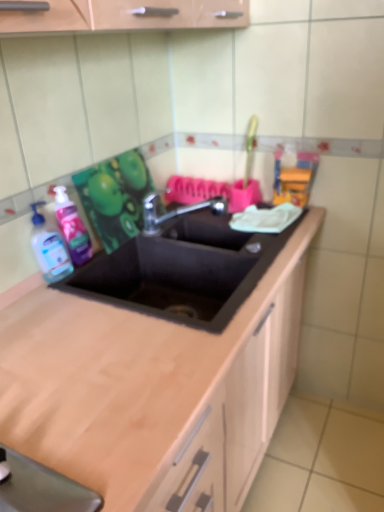
At what (x,y) coordinates should I click in order to perform the action: click on translucent plastic soap dispenser at left. Please return your answer as a coordinate pair (x, y). Image resolution: width=384 pixels, height=512 pixels. Looking at the image, I should click on (72, 228).

The width and height of the screenshot is (384, 512). What do you see at coordinates (182, 270) in the screenshot?
I see `black matte sink at center` at bounding box center [182, 270].

In order to click on transparent plastic bottle at left in this screenshot , I will do `click(49, 249)`.

The height and width of the screenshot is (512, 384). What are the coordinates of `translucent plastic soap dispenser at left` in the screenshot? It's located at (72, 228).

Who is smaller, metallic faucet at center or translucent plastic soap dispenser at left?

Smaller between the two is translucent plastic soap dispenser at left.

Which is more to the right, metallic faucet at center or translucent plastic soap dispenser at left?

metallic faucet at center.

From the image's perspective, relative to translucent plastic soap dispenser at left, is metallic faucet at center above or below?

Clearly, from the image's perspective, metallic faucet at center is above translucent plastic soap dispenser at left.

Which is closer to the camera, (x=61, y=186) or (x=68, y=269)?

Point (x=61, y=186).

Considering the relative sizes of translucent plastic soap dispenser at left and transparent plastic bottle at left in the image provided, is translucent plastic soap dispenser at left bigger than transparent plastic bottle at left?

Actually, translucent plastic soap dispenser at left might be smaller than transparent plastic bottle at left.

Is translucent plastic soap dispenser at left taller or shorter than transparent plastic bottle at left?

Considering their sizes, translucent plastic soap dispenser at left has more height than transparent plastic bottle at left.

Between translucent plastic soap dispenser at left and transparent plastic bottle at left, which one has smaller width?

Thinner between the two is translucent plastic soap dispenser at left.

In the scene shown: Considering their positions, is translucent plastic soap dispenser at left located in front of or behind metallic faucet at center?

translucent plastic soap dispenser at left is positioned closer to the viewer than metallic faucet at center.

Are translucent plastic soap dispenser at left and metallic faucet at center beside each other?

No, translucent plastic soap dispenser at left is not with metallic faucet at center.

Does translucent plastic soap dispenser at left have a greater width compared to metallic faucet at center?

Incorrect, the width of translucent plastic soap dispenser at left does not surpass that of metallic faucet at center.

From the image's perspective, is translucent plastic soap dispenser at left above metallic faucet at center?

No, from the image's perspective, translucent plastic soap dispenser at left is not on top of metallic faucet at center.

From the image's perspective, is metallic faucet at center above or below black matte sink at center?

From the image's perspective, metallic faucet at center appears above black matte sink at center.

Is metallic faucet at center looking in the opposite direction of black matte sink at center?

No, metallic faucet at center is not facing away from black matte sink at center.

Who is more distant, metallic faucet at center or black matte sink at center?

Positioned behind is metallic faucet at center.

Between metallic faucet at center and black matte sink at center, which one appears on the left side from the viewer's perspective?

metallic faucet at center is more to the left.

Is transparent plastic bottle at left to the left of black matte sink at center from the viewer's perspective?

Yes.

In the scene shown: Which of these two, transparent plastic bottle at left or black matte sink at center, stands shorter?

Standing shorter between the two is transparent plastic bottle at left.

Consider the image. From a real-world perspective, is transparent plastic bottle at left positioned under black matte sink at center based on gravity?

No, from a real-world perspective, transparent plastic bottle at left is not beneath black matte sink at center.

From a real-world perspective, between black matte sink at center and metallic faucet at center, who is vertically higher?

metallic faucet at center, from a real-world perspective.

Does point (126, 252) lie in front of point (144, 233)?

Yes, it is.

Could you tell me if black matte sink at center is turned towards metallic faucet at center?

No, black matte sink at center is not turned towards metallic faucet at center.

Is black matte sink at center to the left of transparent plastic bottle at left from the viewer's perspective?

Incorrect, black matte sink at center is not on the left side of transparent plastic bottle at left.

Based on the photo, from the image's perspective, between black matte sink at center and transparent plastic bottle at left, who is located below?

black matte sink at center appears lower in the image.

How many degrees apart are the facing directions of black matte sink at center and transparent plastic bottle at left?

The angle between the facing direction of black matte sink at center and the facing direction of transparent plastic bottle at left is 7.4 degrees.

Locate an element on the screen. tap located above the translucent plastic soap dispenser at left (from the image's perspective) is located at coordinates [x=175, y=210].

You are a GUI agent. You are given a task and a screenshot of the screen. Output one action in this format:
    pyautogui.click(x=<x>, y=<y>)
    Task: Click on the bottle that appears below the translucent plastic soap dispenser at left (from a real-world perspective)
    This screenshot has width=384, height=512.
    Given the screenshot: What is the action you would take?
    pyautogui.click(x=49, y=249)

Based on their spatial positions, is translucent plastic soap dispenser at left or black matte sink at center further from metallic faucet at center?

The object further to metallic faucet at center is translucent plastic soap dispenser at left.

When comparing their distances from transparent plastic bottle at left, does translucent plastic soap dispenser at left or metallic faucet at center seem closer?

translucent plastic soap dispenser at left is positioned closer to the anchor transparent plastic bottle at left.

From the image, which object appears to be farther from black matte sink at center, metallic faucet at center or translucent plastic soap dispenser at left?

Based on the image, translucent plastic soap dispenser at left appears to be further to black matte sink at center.

Estimate the real-world distances between objects in this image. Which object is further from black matte sink at center, translucent plastic soap dispenser at left or transparent plastic bottle at left?

transparent plastic bottle at left is further to black matte sink at center.

Which object lies further to the anchor point black matte sink at center, transparent plastic bottle at left or metallic faucet at center?

transparent plastic bottle at left lies further to black matte sink at center than the other object.

From the image, which object appears to be farther from transparent plastic bottle at left, metallic faucet at center or black matte sink at center?

metallic faucet at center.

From the image, which object appears to be farther from translucent plastic soap dispenser at left, black matte sink at center or transparent plastic bottle at left?

The object further to translucent plastic soap dispenser at left is black matte sink at center.

Considering their positions, is metallic faucet at center positioned closer to translucent plastic soap dispenser at left than black matte sink at center?

The object closer to translucent plastic soap dispenser at left is black matte sink at center.

This screenshot has height=512, width=384. I want to click on tap situated between translucent plastic soap dispenser at left and black matte sink at center from left to right, so click(x=175, y=210).

You are a GUI agent. You are given a task and a screenshot of the screen. Output one action in this format:
    pyautogui.click(x=<x>, y=<y>)
    Task: Click on the tap located between transparent plastic bottle at left and black matte sink at center in the left-right direction
    
    Given the screenshot: What is the action you would take?
    pyautogui.click(x=175, y=210)

At what (x,y) coordinates should I click in order to perform the action: click on cleaning product located between transparent plastic bottle at left and black matte sink at center in the left-right direction. Please return your answer as a coordinate pair (x, y). The height and width of the screenshot is (512, 384). Looking at the image, I should click on (72, 228).

The height and width of the screenshot is (512, 384). I want to click on cleaning product situated between transparent plastic bottle at left and metallic faucet at center from left to right, so click(72, 228).